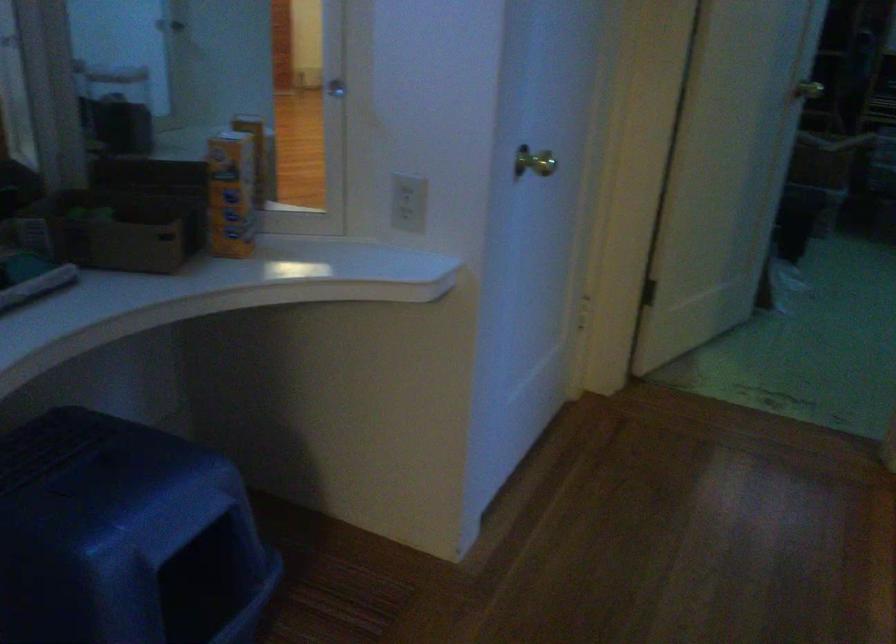
Describe the element at coordinates (533, 162) in the screenshot. The width and height of the screenshot is (896, 644). I see `the brass doorknob` at that location.